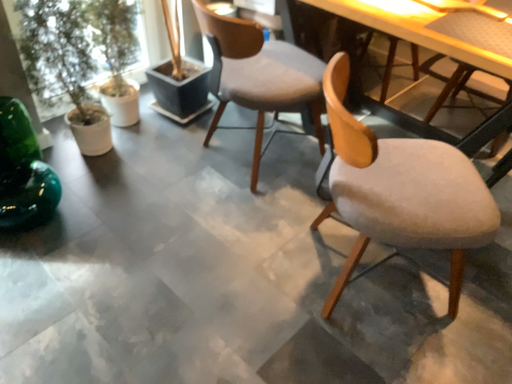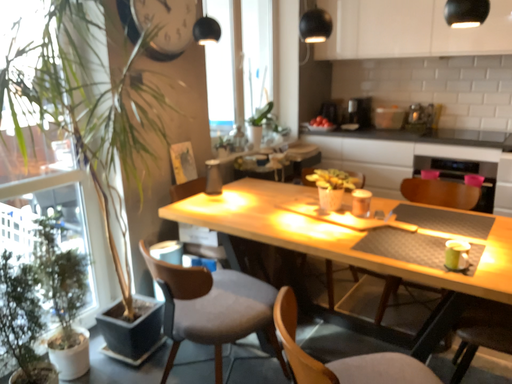
Question: How did the camera likely rotate when shooting the video?

Choices:
 (A) rotated downward
 (B) rotated upward

Answer: (B)